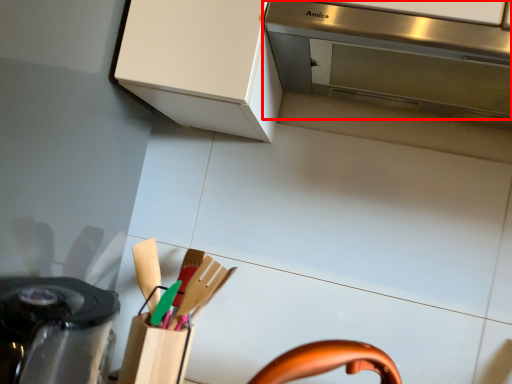
Question: In this image, where is home appliance (annotated by the red box) located relative to kitchen appliance?

Choices:
 (A) left
 (B) right

Answer: (B)